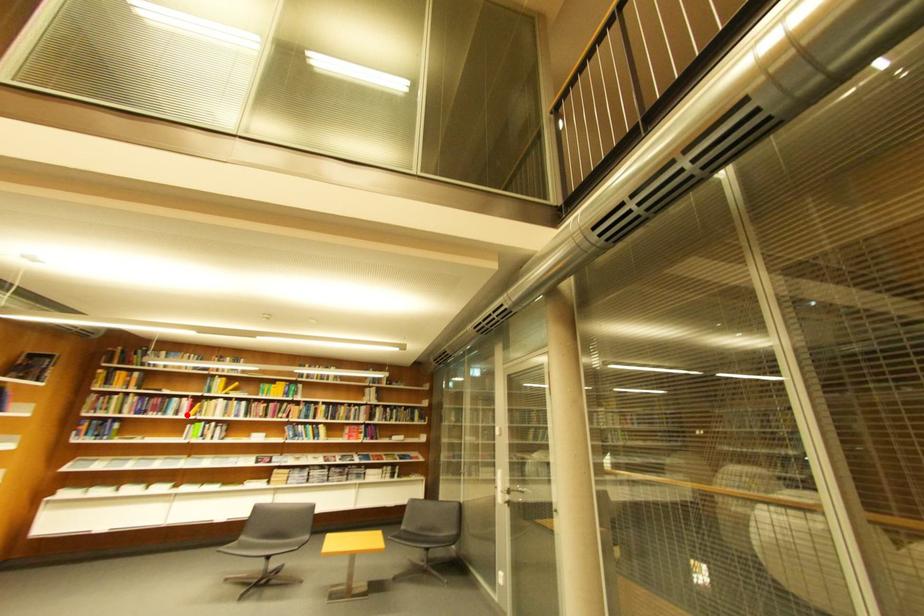
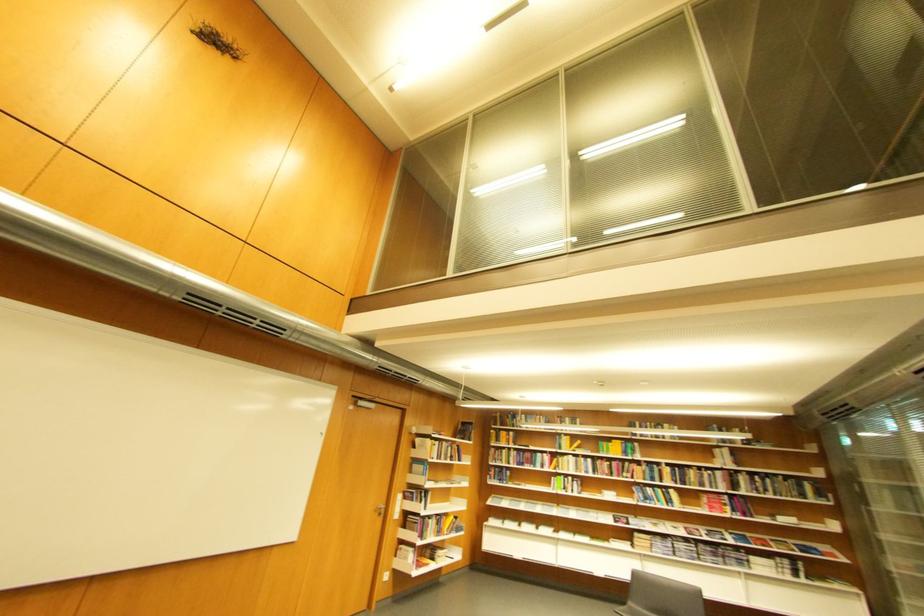
Find the pixel in the second image that matches the highlighted location in the first image.

(553, 468)